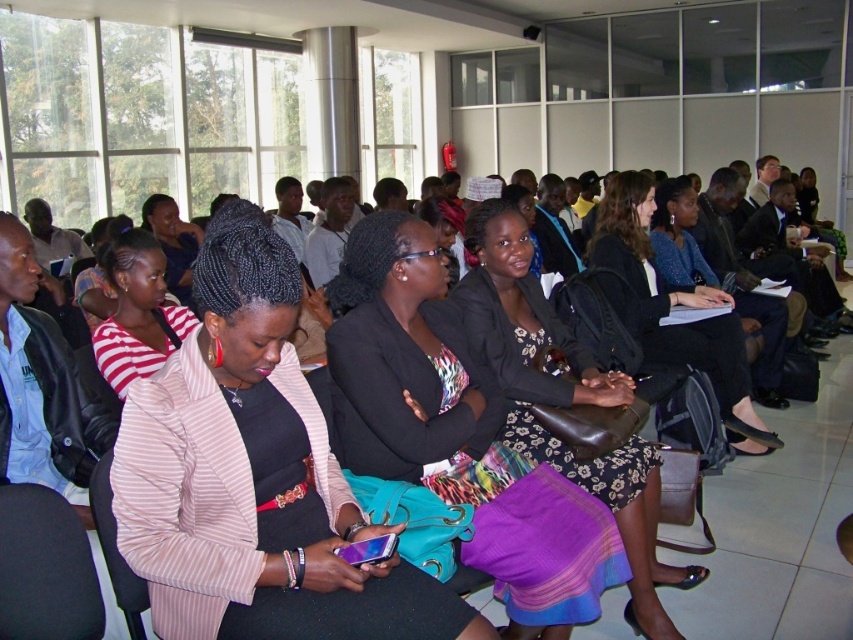
You are sitting at the back of the conference room and want to see the presentation on the stage. There is a black leather jacket at center and a striped fabric shirt at left in your line of sight. Which clothing item is blocking your view more?

The striped fabric shirt at left is behind the black leather jacket at center, so the black leather jacket at center is closer to you and thus blocking your view more.